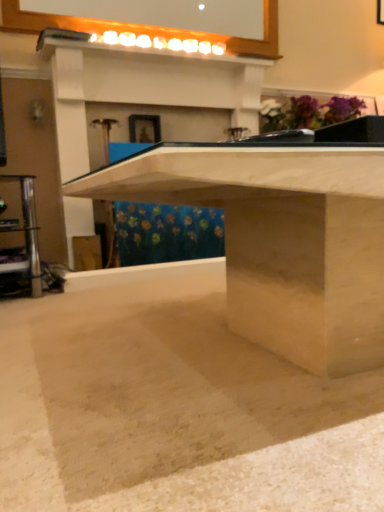
Question: Is there a large distance between sanded wood table at center and smooth concrete at center?

Choices:
 (A) yes
 (B) no

Answer: (B)

Question: Can you confirm if sanded wood table at center is thinner than smooth concrete at center?

Choices:
 (A) no
 (B) yes

Answer: (B)

Question: From a real-world perspective, is sanded wood table at center on top of smooth concrete at center?

Choices:
 (A) no
 (B) yes

Answer: (B)

Question: Is sanded wood table at center at the left side of smooth concrete at center?

Choices:
 (A) yes
 (B) no

Answer: (B)

Question: Is smooth concrete at center surrounded by sanded wood table at center?

Choices:
 (A) no
 (B) yes

Answer: (A)

Question: From the image's perspective, is smooth concrete at center positioned above or below matte gold picture frame at upper center?

Choices:
 (A) below
 (B) above

Answer: (A)

Question: Is smooth concrete at center inside the boundaries of matte gold picture frame at upper center, or outside?

Choices:
 (A) inside
 (B) outside

Answer: (B)

Question: Is point (240, 394) positioned closer to the camera than point (142, 138)?

Choices:
 (A) farther
 (B) closer

Answer: (B)

Question: In the image, is smooth concrete at center positioned in front of or behind matte gold picture frame at upper center?

Choices:
 (A) front
 (B) behind

Answer: (A)

Question: Relative to smooth concrete at center, is sanded wood table at center in front or behind?

Choices:
 (A) behind
 (B) front

Answer: (A)

Question: Is sanded wood table at center to the left or to the right of smooth concrete at center in the image?

Choices:
 (A) right
 (B) left

Answer: (A)

Question: Based on their sizes in the image, would you say sanded wood table at center is bigger or smaller than smooth concrete at center?

Choices:
 (A) big
 (B) small

Answer: (A)

Question: From the image's perspective, is sanded wood table at center located above or below smooth concrete at center?

Choices:
 (A) above
 (B) below

Answer: (A)

Question: From a real-world perspective, relative to sanded wood table at center, is smooth concrete at center vertically above or below?

Choices:
 (A) below
 (B) above

Answer: (A)

Question: Looking at their shapes, would you say smooth concrete at center is wider or thinner than sanded wood table at center?

Choices:
 (A) wide
 (B) thin

Answer: (A)